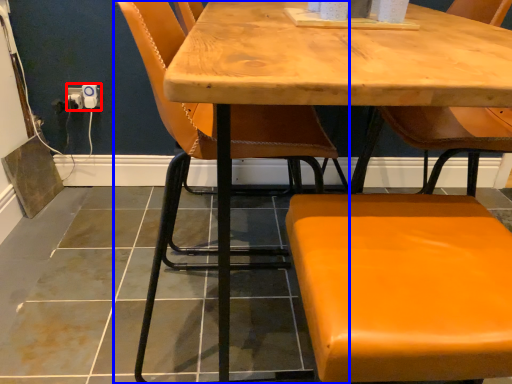
Question: Which object appears farthest to the camera in this image, electric outlet (highlighted by a red box) or chair (highlighted by a blue box)?

Choices:
 (A) electric outlet
 (B) chair

Answer: (A)